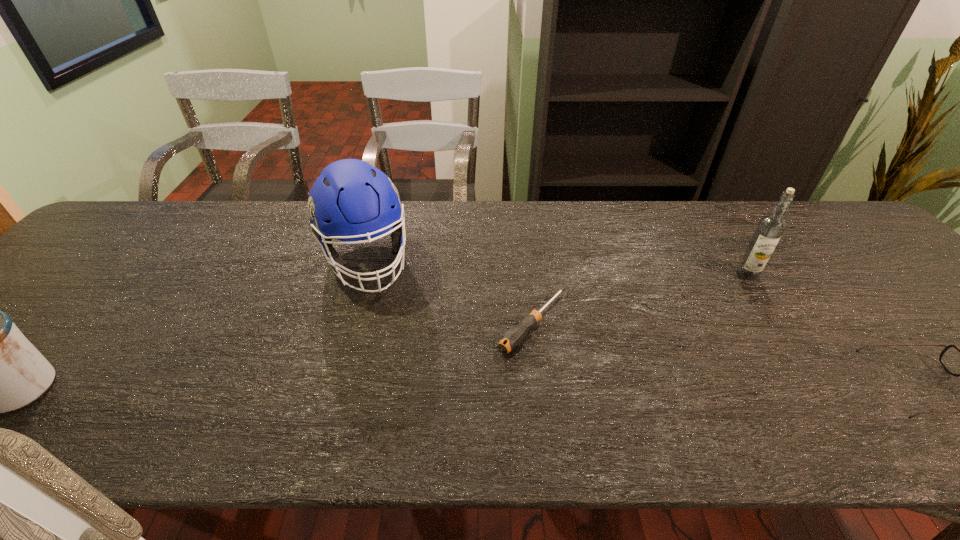
Where is `vacant region located 0.110m at the tip of the shortest object`? The width and height of the screenshot is (960, 540). vacant region located 0.110m at the tip of the shortest object is located at coordinates (479, 381).

In order to click on vacant position located at the tip of the shortest object in this screenshot , I will do `click(479, 381)`.

Identify the location of vacant space located 0.160m at the tip of the shortest object. This screenshot has height=540, width=960. coord(464,397).

Where is `object located in the far edge section of the desktop`? object located in the far edge section of the desktop is located at coordinates coord(351,200).

Locate an element on the screen. vacant space at the far edge is located at coordinates (178, 226).

Image resolution: width=960 pixels, height=540 pixels. In the image, there is a desktop. Find the location of `free space at the near edge`. free space at the near edge is located at coordinates (151, 373).

In the image, there is a desktop. Where is `vacant space at the right edge`? The image size is (960, 540). vacant space at the right edge is located at coordinates (899, 304).

The width and height of the screenshot is (960, 540). In order to click on vacant space at the far left corner of the desktop in this screenshot , I will do `click(113, 223)`.

Locate an element on the screen. This screenshot has width=960, height=540. empty location between the screwdriver and the vodka is located at coordinates pos(640,299).

Identify the location of free area in between the vodka and the screwdriver. The height and width of the screenshot is (540, 960). (640, 299).